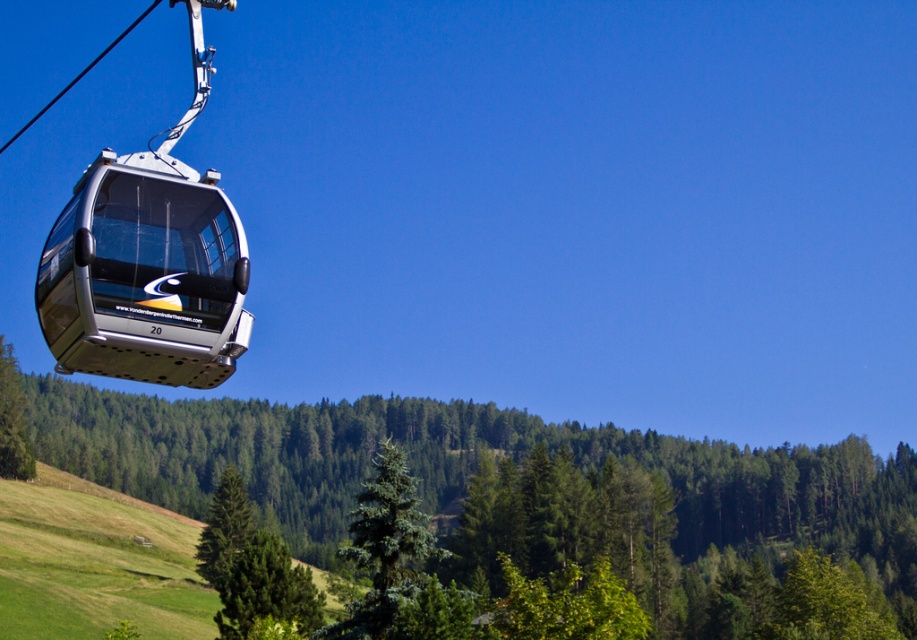
You are standing at the point marked by the coordinates point (506, 490) in the image. What object are you directly facing?

The point (506, 490) marks the green matte tree at center, so you are directly facing the green matte tree at center.

You are a passenger in the cable car and looking down at the landscape. You see a green matte tree at center and a green fir tree at center. Which tree is closer to the cable car?

The green matte tree at center is closer to the cable car because the green fir tree at center is behind it.